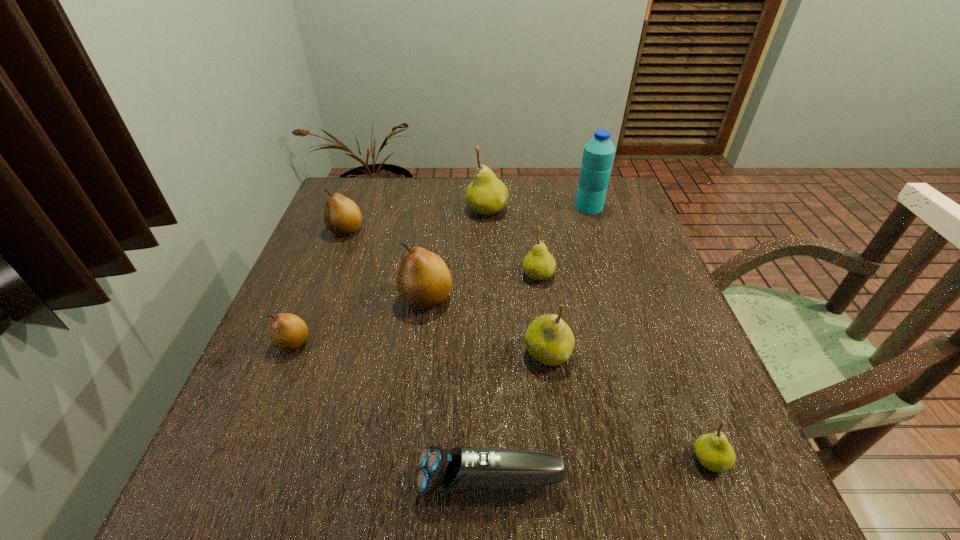
Where is `object located at the near right corner`? The height and width of the screenshot is (540, 960). object located at the near right corner is located at coordinates (714, 452).

I want to click on vacant space at the far edge of the desktop, so click(444, 188).

Find the location of `free space at the left edge`. free space at the left edge is located at coordinates (341, 239).

The height and width of the screenshot is (540, 960). I want to click on vacant area at the right edge, so click(x=650, y=336).

Locate an element on the screen. Image resolution: width=960 pixels, height=540 pixels. vacant region at the far left corner of the desktop is located at coordinates (354, 189).

Where is `free space at the near right corner of the desktop`? free space at the near right corner of the desktop is located at coordinates (740, 483).

Find the location of `free area in between the biggest brown pear and the water bottle`. free area in between the biggest brown pear and the water bottle is located at coordinates (508, 252).

Where is `free point between the second nearest brown pear and the nearest brown pear`? The image size is (960, 540). free point between the second nearest brown pear and the nearest brown pear is located at coordinates (360, 321).

The height and width of the screenshot is (540, 960). What are the coordinates of `vacant space that's between the second farthest green pear and the water bottle` in the screenshot? It's located at (564, 240).

Image resolution: width=960 pixels, height=540 pixels. What are the coordinates of `free spot between the third nearest green pear and the rightmost green pear` in the screenshot? It's located at (624, 367).